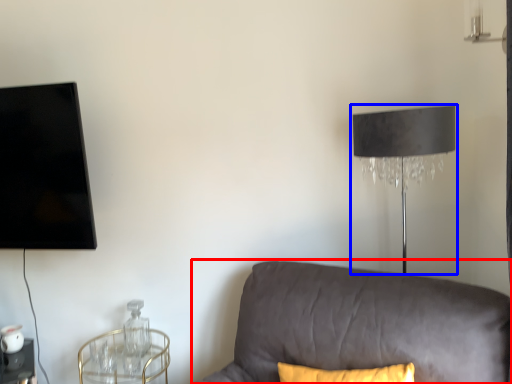
Question: Among these objects, which one is nearest to the camera, studio couch (highlighted by a red box) or lamp (highlighted by a blue box)?

Choices:
 (A) studio couch
 (B) lamp

Answer: (A)